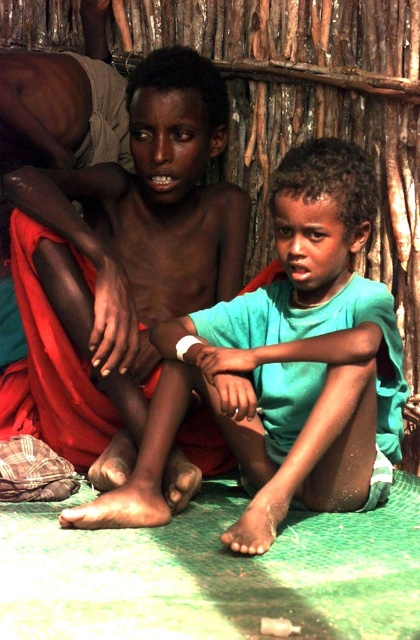
You are a visitor in the hut and need to locate the green matte shirt at center. According to the coordinates provided, where should you look to find it?

The green matte shirt at center is located at point (286, 365).

You are a tailor who needs to determine which item is shorter between the green matte shirt at center and the matte skin boy at center. Which one should you choose?

The green matte shirt at center is not as tall as the matte skin boy at center, so the green matte shirt at center is shorter and should be chosen.